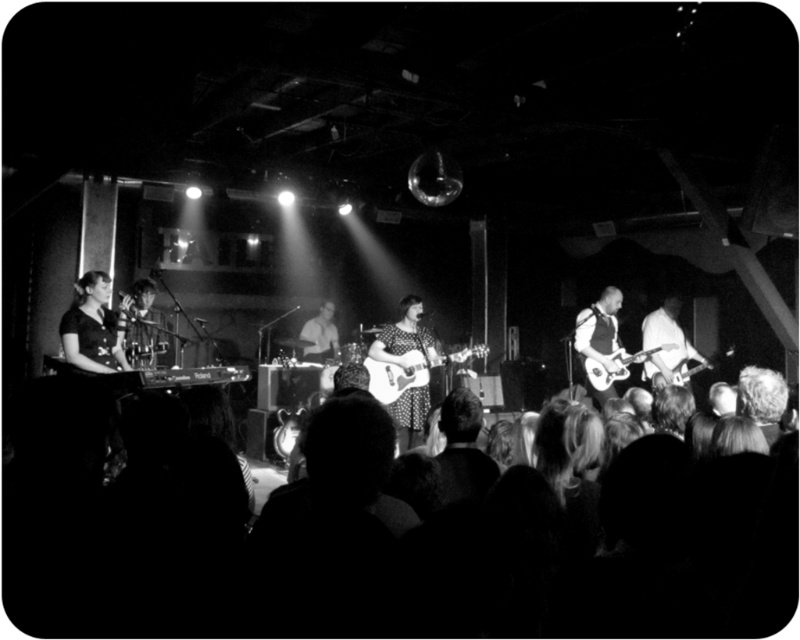
Question: Is polka dot dress at center above shiny metallic guitar at right?

Choices:
 (A) no
 (B) yes

Answer: (A)

Question: Which is nearer to the shiny metallic guitar at right?

Choices:
 (A) polka dot dress at center
 (B) metallic silver guitar at center

Answer: (B)

Question: Which point appears farthest from the camera in this image?

Choices:
 (A) (400, 378)
 (B) (428, 340)
 (C) (316, 440)
 (D) (608, 371)

Answer: (D)

Question: Is silhouette crowd at lower center positioned at the back of metallic silver guitar at center?

Choices:
 (A) yes
 (B) no

Answer: (B)

Question: Can you confirm if polka dot dress at center is positioned above shiny metallic guitar at right?

Choices:
 (A) yes
 (B) no

Answer: (B)

Question: Which object is closer to the camera taking this photo?

Choices:
 (A) shiny metallic guitar at right
 (B) silhouette crowd at lower center

Answer: (B)